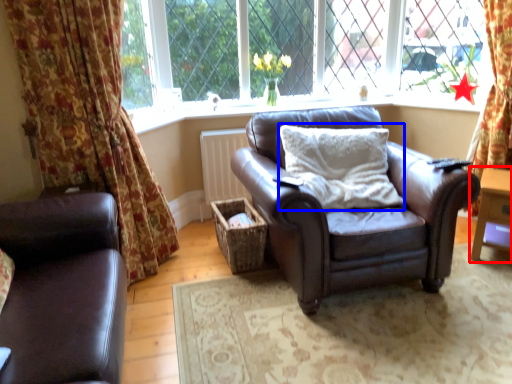
Question: Which point is closer to the camera, table (highlighted by a red box) or pillow (highlighted by a blue box)?

Choices:
 (A) table
 (B) pillow

Answer: (B)